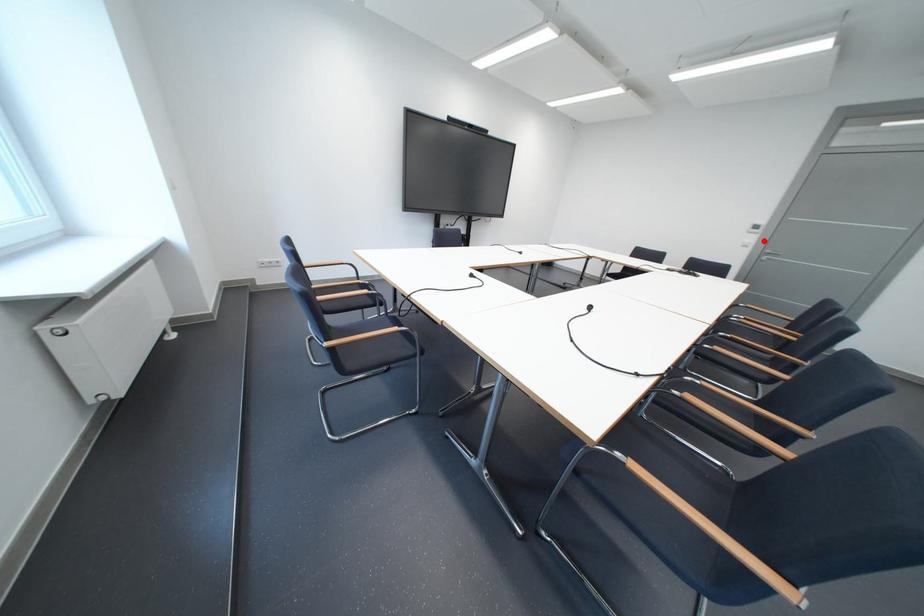
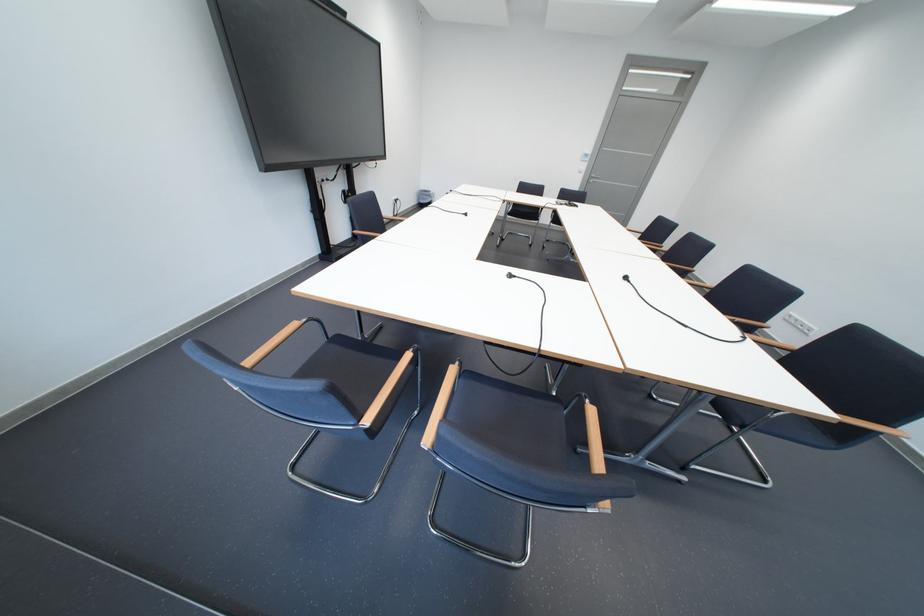
In the second image, find the point that corresponds to the highlighted location in the first image.

(596, 168)